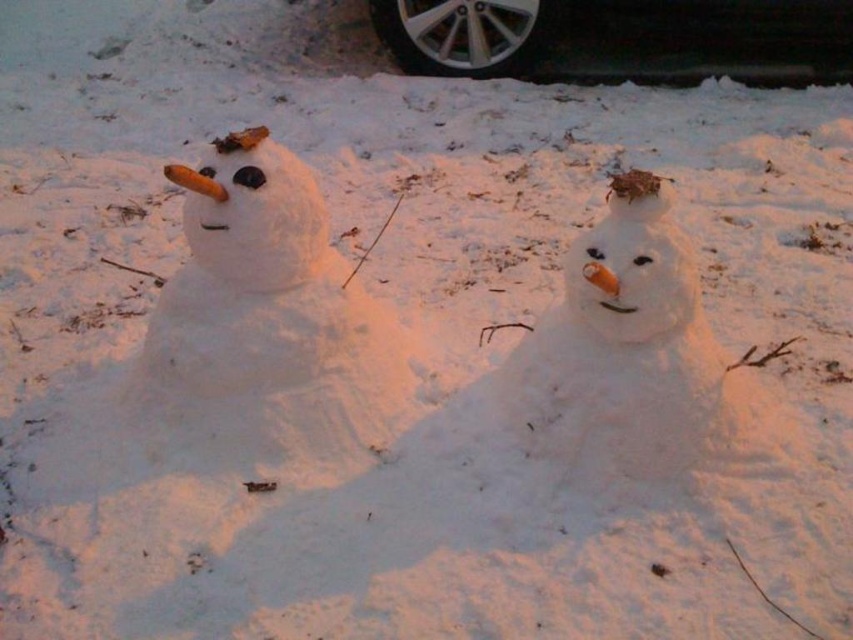
Between white fluffy snowman at left and white fluffy snowman at center, which one is positioned higher?

white fluffy snowman at left is higher up.

Looking at this image, is white fluffy snowman at left positioned before white fluffy snowman at center?

No, white fluffy snowman at left is behind white fluffy snowman at center.

Between point (251, 157) and point (695, 372), which one is positioned in front?

Point (695, 372) is more forward.

The image size is (853, 640). In order to click on white fluffy snowman at left in this screenshot , I will do `click(265, 323)`.

Consider the image. Which is below, white fluffy snowman at left or black rubber tire at upper center?

white fluffy snowman at left is below.

Does point (199, 310) come behind point (761, 67)?

No, it is in front of (761, 67).

Where is `white fluffy snowman at left`? The image size is (853, 640). white fluffy snowman at left is located at coordinates (265, 323).

Is white fluffy snowman at center bigger than black rubber tire at upper center?

No.

Is point (601, 296) closer to viewer compared to point (547, 26)?

Yes, it is.

Image resolution: width=853 pixels, height=640 pixels. I want to click on white fluffy snowman at center, so click(x=621, y=348).